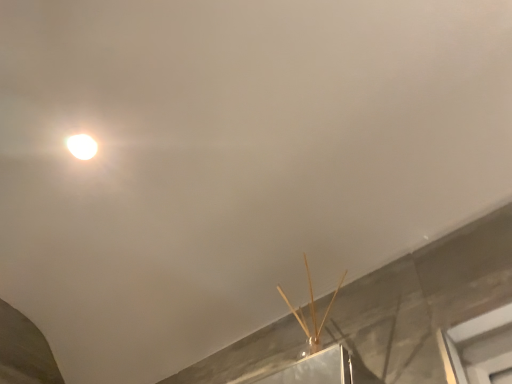
In order to face white glossy light bulb at upper left, should I rotate leftwards or rightwards?

It's best to rotate left around 21.984 degrees.

The height and width of the screenshot is (384, 512). Identify the location of white glossy light bulb at upper left. (79, 141).

The image size is (512, 384). What do you see at coordinates (79, 141) in the screenshot? I see `white glossy light bulb at upper left` at bounding box center [79, 141].

Where is `white glossy light bulb at upper left`? white glossy light bulb at upper left is located at coordinates 79,141.